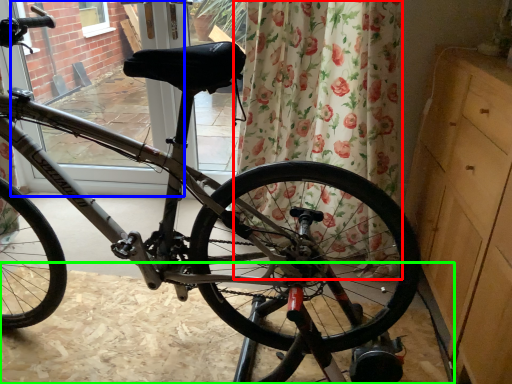
Question: Based on their relative distances, which object is farther from curtain (highlighted by a red box)? Choose from screen door (highlighted by a blue box) and dirt track (highlighted by a green box).

Choices:
 (A) screen door
 (B) dirt track

Answer: (A)